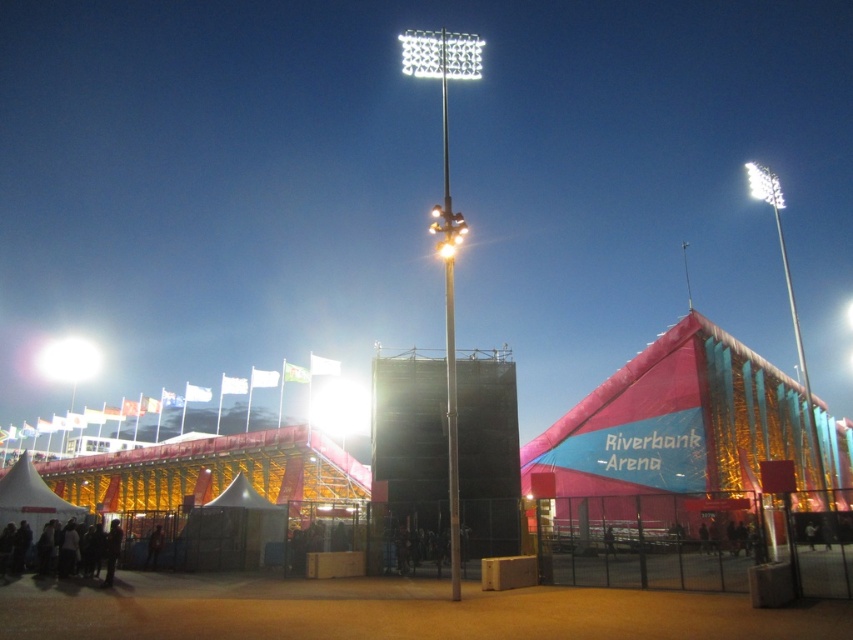
Is white canvas tent at lower left taller than white plastic floodlight at upper center?

Yes.

Does white canvas tent at lower left appear under white plastic floodlight at upper center?

Indeed, white canvas tent at lower left is positioned under white plastic floodlight at upper center.

Measure the distance between point (30,502) and camera.

78.65 meters

The width and height of the screenshot is (853, 640). I want to click on white canvas tent at lower left, so click(x=32, y=499).

Describe the element at coordinates (68, 358) in the screenshot. I see `bright white light at upper left` at that location.

Image resolution: width=853 pixels, height=640 pixels. What are the coordinates of `bright white light at upper left` in the screenshot? It's located at (68, 358).

Identify the location of white fabric tent at center. The image size is (853, 640). pyautogui.click(x=231, y=529).

Consider the image. Does white fabric tent at center have a larger size compared to dark clothing at lower left?

Indeed, white fabric tent at center has a larger size compared to dark clothing at lower left.

Between point (259, 529) and point (109, 547), which one is positioned behind?

The point (259, 529) is behind.

This screenshot has height=640, width=853. I want to click on white fabric tent at center, so click(231, 529).